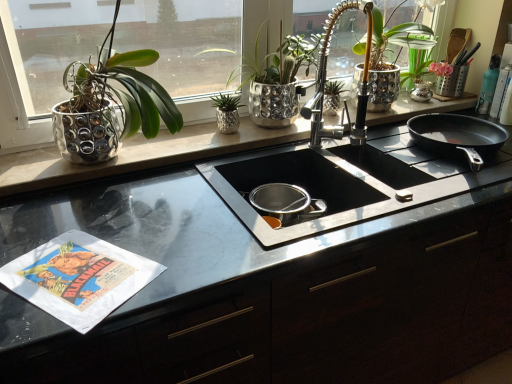
You are a GUI agent. You are given a task and a screenshot of the screen. Output one action in this format:
    pyautogui.click(x=<x>, y=<y>)
    Task: Click on the green metallic plant at center, which ranks as the third houseplant in right-to-left order
    
    Given the screenshot: What is the action you would take?
    pyautogui.click(x=227, y=112)

What do you see at coordinates (395, 60) in the screenshot?
I see `shiny silver pot at upper right, which is counted as the 4th houseplant, starting from the left` at bounding box center [395, 60].

The image size is (512, 384). What do you see at coordinates (110, 104) in the screenshot? I see `shiny metallic plant at left, marked as the 4th houseplant in a right-to-left arrangement` at bounding box center [110, 104].

What do you see at coordinates (458, 136) in the screenshot?
I see `black non-stick frying pan at right` at bounding box center [458, 136].

What is the approximate width of wooden utensils at upper right?

It is 6.35 inches.

The image size is (512, 384). Identify the location of black stainless steel gas stove at center. (344, 182).

In order to click on green metallic plant at center, which ranks as the third houseplant in right-to-left order in this screenshot , I will do [227, 112].

Is green metallic plant at center, which ranks as the third houseplant in right-to-left order, positioned with its back to shiny metallic pot at center, marked as the third houseplant in a left-to-right arrangement?

That's right, green metallic plant at center, which ranks as the third houseplant in right-to-left order, is facing away from shiny metallic pot at center, marked as the third houseplant in a left-to-right arrangement.

Considering the positions of points (234, 119) and (288, 105), is point (234, 119) farther from camera compared to point (288, 105)?

No, it is in front of (288, 105).

Based on their sizes in the image, would you say green metallic plant at center, which is the 2th houseplant in left-to-right order, is bigger or smaller than shiny metallic pot at center, marked as the third houseplant in a left-to-right arrangement?

Considering their sizes, green metallic plant at center, which is the 2th houseplant in left-to-right order, takes up less space than shiny metallic pot at center, marked as the third houseplant in a left-to-right arrangement.

Between shiny silver pot at upper right, which is counted as the 4th houseplant, starting from the left, and black non-stick frying pan at right, which one has more height?

shiny silver pot at upper right, which is counted as the 4th houseplant, starting from the left, is taller.

Is shiny silver pot at upper right, the first houseplant positioned from the right, turned away from black non-stick frying pan at right?

No, black non-stick frying pan at right is not at the back of shiny silver pot at upper right, the first houseplant positioned from the right.

Where is `the 2nd houseplant to the left of the shiny silver pot at upper right, which is counted as the 4th houseplant, starting from the left, starting your count from the anchor`? This screenshot has height=384, width=512. the 2nd houseplant to the left of the shiny silver pot at upper right, which is counted as the 4th houseplant, starting from the left, starting your count from the anchor is located at coordinates (227, 112).

Which point is more distant from viewer, (212, 105) or (402, 24)?

The point (402, 24) is farther from the camera.

Measure the distance from green metallic plant at center, which ranks as the third houseplant in right-to-left order, to shiny silver pot at upper right, the first houseplant positioned from the right.

The distance of green metallic plant at center, which ranks as the third houseplant in right-to-left order, from shiny silver pot at upper right, the first houseplant positioned from the right, is 24.06 inches.

From the image's perspective, is green metallic plant at center, which is the 2th houseplant in left-to-right order, beneath shiny silver pot at upper right, which is counted as the 4th houseplant, starting from the left?

Correct, green metallic plant at center, which is the 2th houseplant in left-to-right order, appears lower than shiny silver pot at upper right, which is counted as the 4th houseplant, starting from the left, in the image.

Which point is more distant from viewer, (413, 185) or (426, 362)?

Positioned behind is point (426, 362).

Can you confirm if black stainless steel gas stove at center is positioned to the right of black glossy countertop at center?

In fact, black stainless steel gas stove at center is to the left of black glossy countertop at center.

Looking at this image, between black stainless steel gas stove at center and black glossy countertop at center, which one has larger size?

black glossy countertop at center is bigger.

Is black stainless steel gas stove at center turned away from black glossy countertop at center?

Yes.

From the image's perspective, is shiny metallic pot at center, marked as the third houseplant in a left-to-right arrangement, located above wooden utensils at upper right?

No, from the image's perspective, shiny metallic pot at center, marked as the third houseplant in a left-to-right arrangement, is not above wooden utensils at upper right.

Considering the relative sizes of shiny metallic pot at center, marked as the 2th houseplant in a right-to-left arrangement, and wooden utensils at upper right in the image provided, is shiny metallic pot at center, marked as the 2th houseplant in a right-to-left arrangement, shorter than wooden utensils at upper right?

No.

From a real-world perspective, which object stands above the other?

In real-world perspective, shiny metallic pot at center, marked as the third houseplant in a left-to-right arrangement, is above.

Who is smaller, shiny silver pot at upper right, the first houseplant positioned from the right, or green metallic plant at center, which ranks as the third houseplant in right-to-left order?

Smaller between the two is green metallic plant at center, which ranks as the third houseplant in right-to-left order.

Which object is positioned more to the left, shiny silver pot at upper right, the first houseplant positioned from the right, or green metallic plant at center, which ranks as the third houseplant in right-to-left order?

Positioned to the left is green metallic plant at center, which ranks as the third houseplant in right-to-left order.

What's the angular difference between shiny silver pot at upper right, which is counted as the 4th houseplant, starting from the left, and green metallic plant at center, which is the 2th houseplant in left-to-right order,'s facing directions?

The angle between the facing direction of shiny silver pot at upper right, which is counted as the 4th houseplant, starting from the left, and the facing direction of green metallic plant at center, which is the 2th houseplant in left-to-right order, is 0.000269 degrees.

Does shiny silver pot at upper right, the first houseplant positioned from the right, lie behind green metallic plant at center, which ranks as the third houseplant in right-to-left order?

Yes, shiny silver pot at upper right, the first houseplant positioned from the right, is further from the camera.

Does black glossy countertop at center have a lesser width compared to shiny metallic pot at center, marked as the 2th houseplant in a right-to-left arrangement?

In fact, black glossy countertop at center might be wider than shiny metallic pot at center, marked as the 2th houseplant in a right-to-left arrangement.

From the image's perspective, which one is positioned higher, black glossy countertop at center or shiny metallic pot at center, marked as the 2th houseplant in a right-to-left arrangement?

From the image's view, shiny metallic pot at center, marked as the 2th houseplant in a right-to-left arrangement, is above.

Is black glossy countertop at center not close to shiny metallic pot at center, marked as the third houseplant in a left-to-right arrangement?

black glossy countertop at center is actually quite close to shiny metallic pot at center, marked as the third houseplant in a left-to-right arrangement.

Is black glossy countertop at center oriented towards shiny metallic pot at center, marked as the third houseplant in a left-to-right arrangement?

No, black glossy countertop at center does not turn towards shiny metallic pot at center, marked as the third houseplant in a left-to-right arrangement.

The width and height of the screenshot is (512, 384). What are the coordinates of `the 1st houseplant positioned above the green metallic plant at center, which ranks as the third houseplant in right-to-left order (from a real-world perspective)` in the screenshot? It's located at (278, 80).

The image size is (512, 384). In order to click on frying pan on the right of shiny silver pot at upper right, which is counted as the 4th houseplant, starting from the left in this screenshot , I will do `click(458, 136)`.

From the image, which object appears to be nearer to wooden utensils at upper right, green metallic plant at center, which ranks as the third houseplant in right-to-left order, or black non-stick frying pan at right?

Based on the image, black non-stick frying pan at right appears to be nearer to wooden utensils at upper right.

Which object lies nearer to the anchor point wooden utensils at upper right, shiny metallic pot at center, marked as the 2th houseplant in a right-to-left arrangement, or shiny silver pot at upper right, the first houseplant positioned from the right?

The object closer to wooden utensils at upper right is shiny silver pot at upper right, the first houseplant positioned from the right.

Which object lies further to the anchor point black glossy countertop at center, black stainless steel gas stove at center or shiny metallic plant at left, which appears as the first houseplant when viewed from the left?

The object further to black glossy countertop at center is shiny metallic plant at left, which appears as the first houseplant when viewed from the left.

Estimate the real-world distances between objects in this image. Which object is closer to black non-stick frying pan at right, black stainless steel gas stove at center or shiny metallic plant at left, marked as the 4th houseplant in a right-to-left arrangement?

The object closer to black non-stick frying pan at right is black stainless steel gas stove at center.

From the image, which object appears to be farther from black stainless steel gas stove at center, green metallic plant at center, which ranks as the third houseplant in right-to-left order, or wooden utensils at upper right?

wooden utensils at upper right is further to black stainless steel gas stove at center.

From the image, which object appears to be nearer to shiny silver pot at upper right, which is counted as the 4th houseplant, starting from the left, wooden utensils at upper right or black non-stick frying pan at right?

wooden utensils at upper right is closer to shiny silver pot at upper right, which is counted as the 4th houseplant, starting from the left.

Estimate the real-world distances between objects in this image. Which object is closer to wooden utensils at upper right, black non-stick frying pan at right or green metallic plant at center, which is the 2th houseplant in left-to-right order?

The object closer to wooden utensils at upper right is black non-stick frying pan at right.

Considering their positions, is wooden utensils at upper right positioned further to black non-stick frying pan at right than shiny metallic plant at left, marked as the 4th houseplant in a right-to-left arrangement?

shiny metallic plant at left, marked as the 4th houseplant in a right-to-left arrangement, is further to black non-stick frying pan at right.

Where is `gas stove between green metallic plant at center, which ranks as the third houseplant in right-to-left order, and shiny silver pot at upper right, which is counted as the 4th houseplant, starting from the left`? This screenshot has width=512, height=384. gas stove between green metallic plant at center, which ranks as the third houseplant in right-to-left order, and shiny silver pot at upper right, which is counted as the 4th houseplant, starting from the left is located at coordinates (344, 182).

This screenshot has width=512, height=384. Find the location of `gas stove between shiny metallic pot at center, marked as the third houseplant in a left-to-right arrangement, and black glossy countertop at center, in the vertical direction`. gas stove between shiny metallic pot at center, marked as the third houseplant in a left-to-right arrangement, and black glossy countertop at center, in the vertical direction is located at coordinates (344, 182).

The image size is (512, 384). Identify the location of gas stove located between shiny metallic plant at left, which appears as the first houseplant when viewed from the left, and black non-stick frying pan at right in the left-right direction. (344, 182).

You are a GUI agent. You are given a task and a screenshot of the screen. Output one action in this format:
    pyautogui.click(x=<x>, y=<y>)
    Task: Click on the frying pan between shiny metallic pot at center, marked as the third houseplant in a left-to-right arrangement, and black glossy countertop at center vertically
    
    Given the screenshot: What is the action you would take?
    pyautogui.click(x=458, y=136)